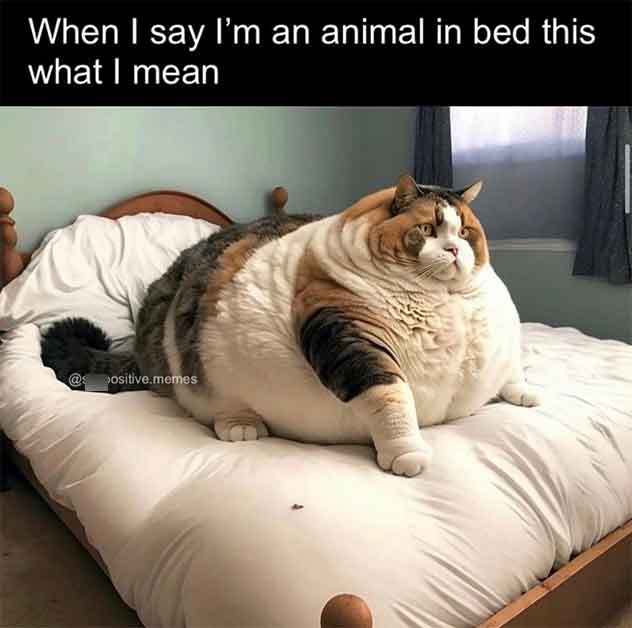
At what (x,y) coordinates should I click in order to perform the action: click on curtain. Please return your answer as a coordinate pair (x, y). The image size is (632, 628). Looking at the image, I should click on (435, 157), (610, 158).